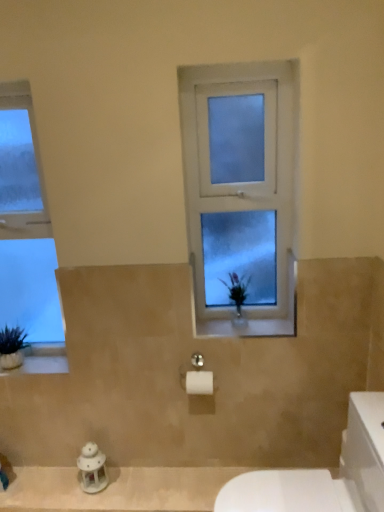
Find the location of a particular element. free space in front of white porcelain lantern at lower left is located at coordinates [x=99, y=500].